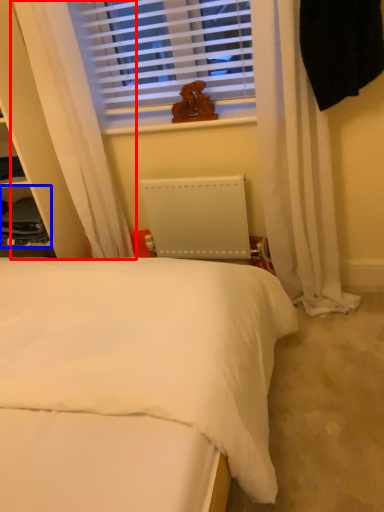
Question: Which object appears closest to the camera in this image, curtain (highlighted by a red box) or cabinet (highlighted by a blue box)?

Choices:
 (A) curtain
 (B) cabinet

Answer: (A)